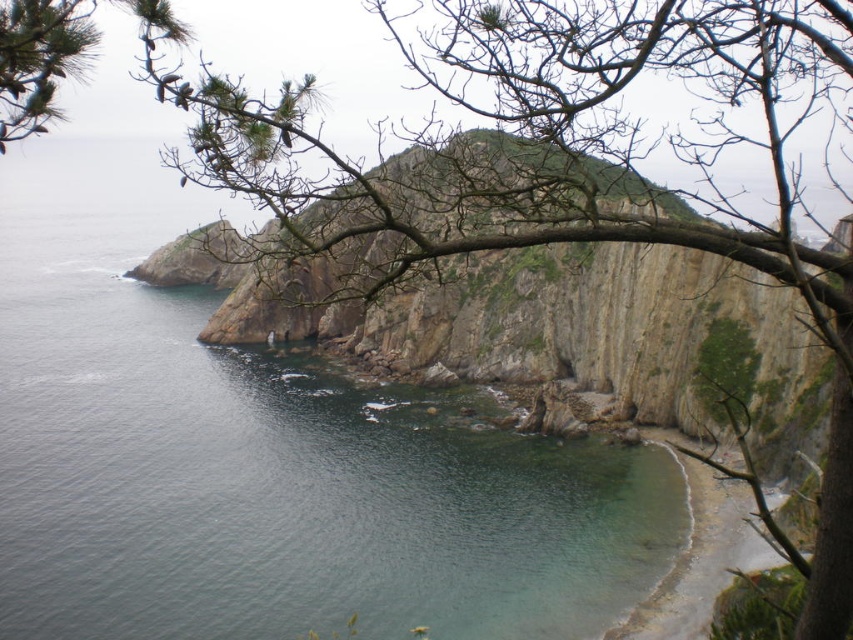
You are standing on the clear sand beach at lower right and want to reach the clear water at center. Based on the scene description, which direction should you move to get to the water?

The clear water at center is larger in size than the clear sand beach at lower right. To reach the water from the beach, you should move towards the center of the scene where the larger body of clear water is located.

You are standing on the clear sand beach at lower right and want to walk to the clear water at center. Which direction should you move?

You should move to the left to reach the clear water at center since it is located to the left of the clear sand beach at lower right.